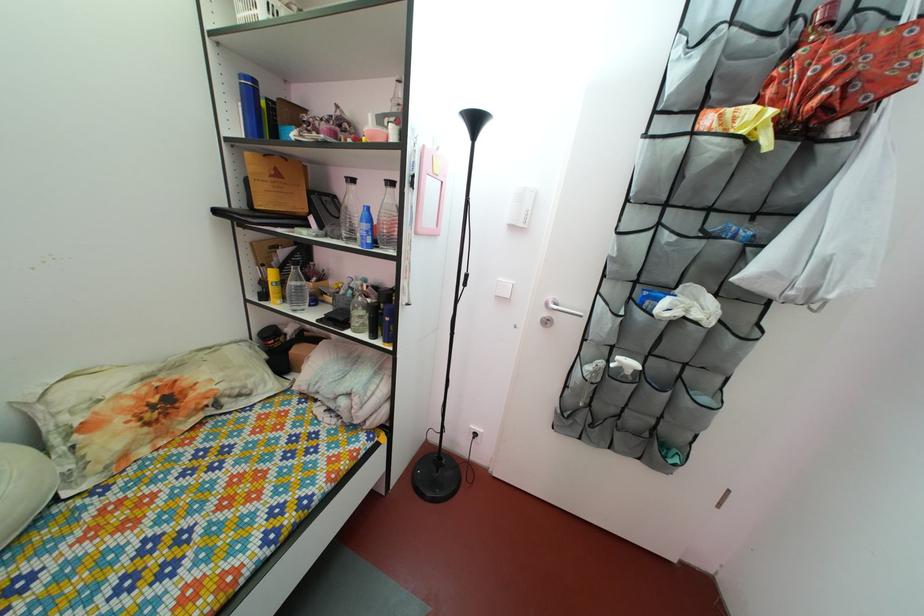
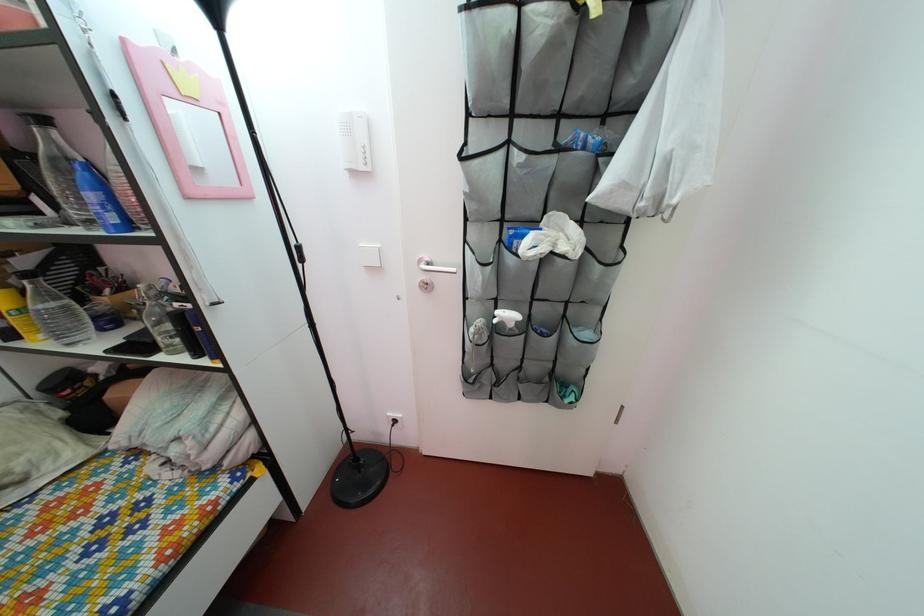
The point at (378, 249) is marked in the first image. Where is the corresponding point in the second image?

(124, 229)